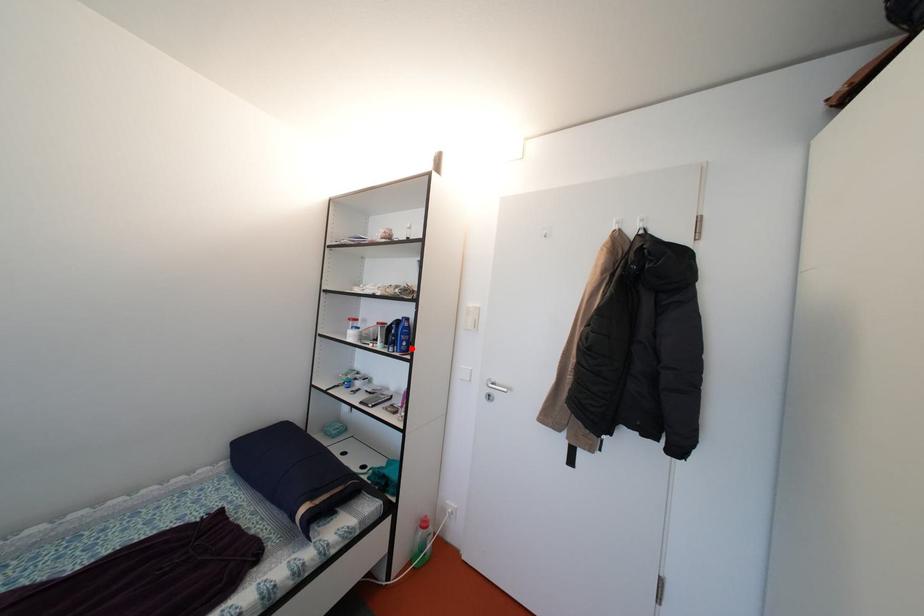
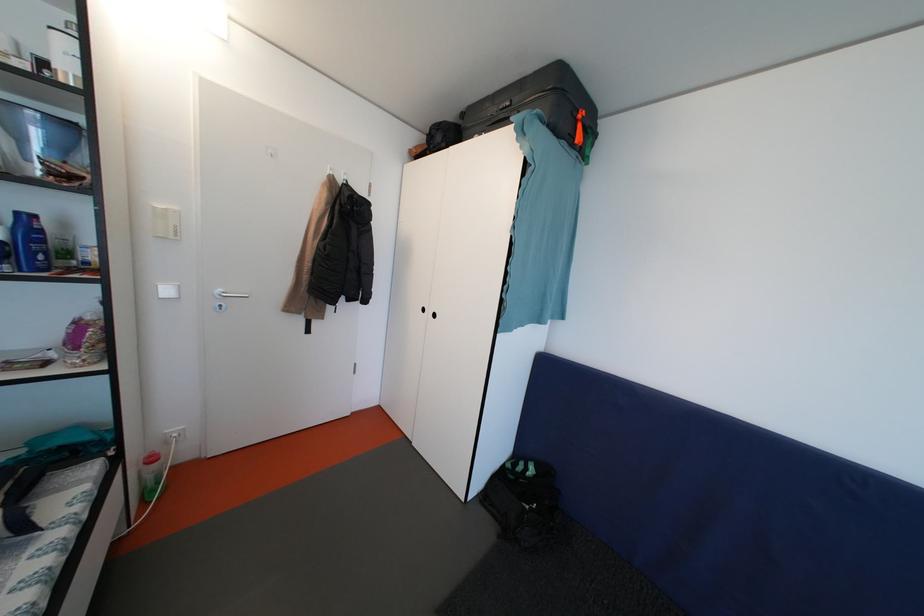
Find the pixel in the second image that matches the highlighted location in the first image.

(49, 262)